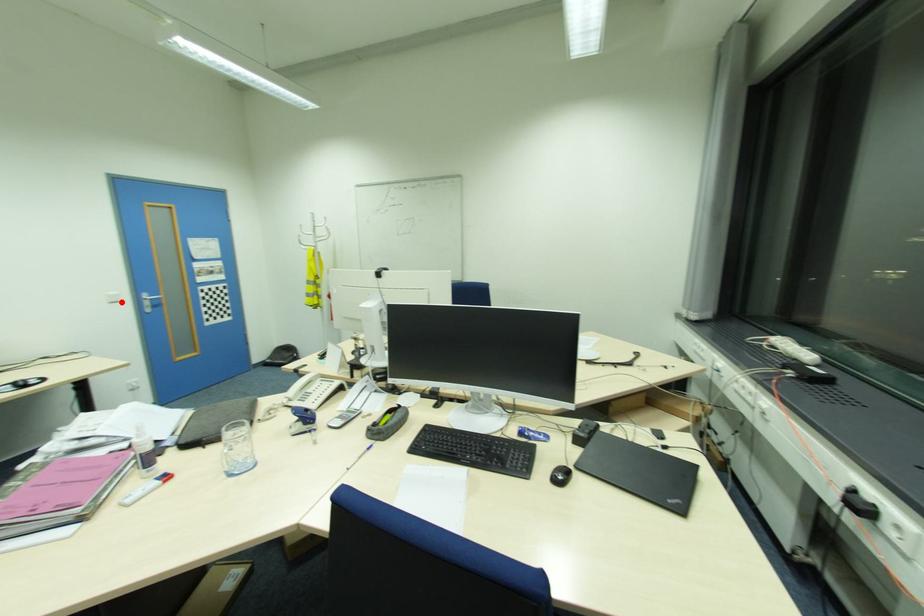
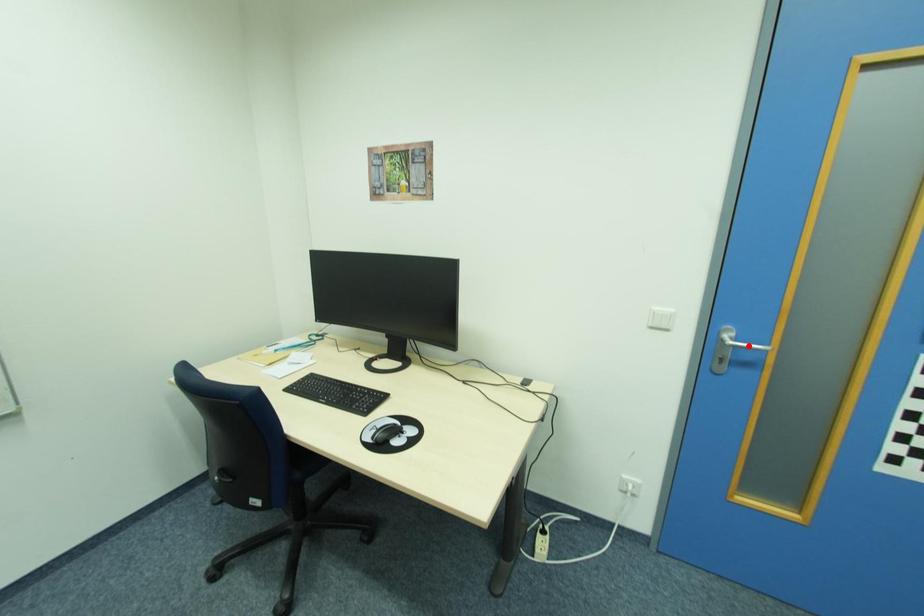
I am providing you with two images of the same scene from different viewpoints. A red point is marked on the first image and another point is marked on the second image. Is the marked point in image1 the same physical position as the marked point in image2?

No